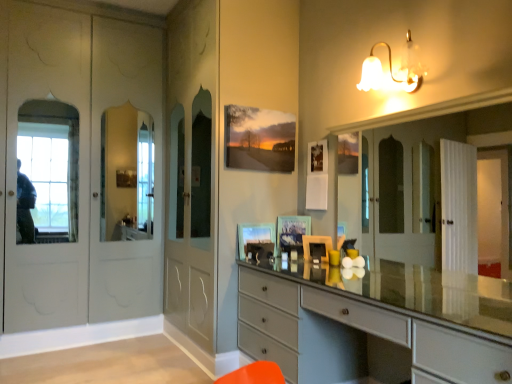
Image resolution: width=512 pixels, height=384 pixels. I want to click on vacant location below white glass bell-shaped light fixture at upper right (from a real-world perspective), so click(392, 286).